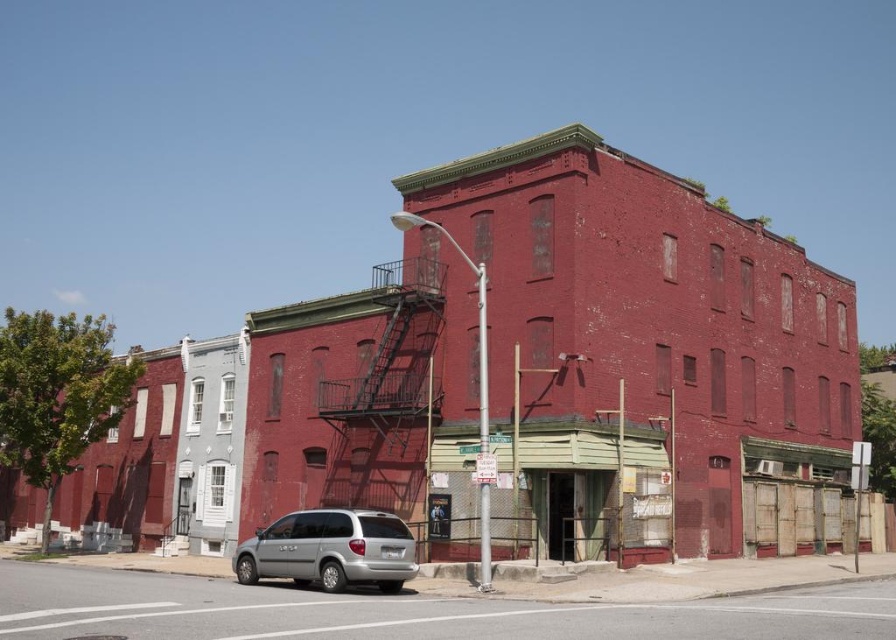
You are a delivery person trying to park your silver metallic minivan at lower center near the rusty metal fire escape at center. Can you park your vehicle there without overlapping the fire escape?

The rusty metal fire escape at center is wider than the silver metallic minivan at lower center, so there might be enough space to park the minivan without overlapping the fire escape. However, since the exact positioning isn not specified, it depends on how you align them.

You are standing on the street looking at the two buildings. There are two points marked on the buildings. One is at coordinate point (x=426, y=344) and the other is at point (x=366, y=516). Which point is closer to you?

Point (x=366, y=516) is closer to you because it is closer to the camera than point (x=426, y=344).

What are the coordinates of the rusty metal fire escape at center?

The coordinates of the rusty metal fire escape at center are at point (388, 396).